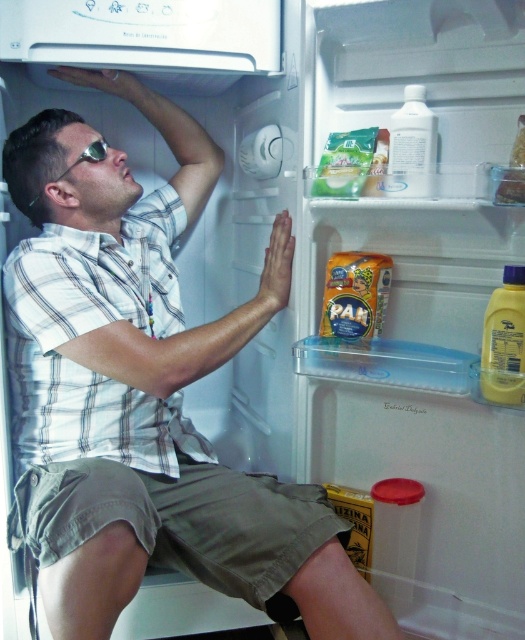
Question: Which point is closer to the camera?

Choices:
 (A) yellow plastic bottle at right
 (B) translucent plastic container at upper right
 (C) sunglasses at upper left

Answer: (B)

Question: Which of the following is the farthest from the observer?

Choices:
 (A) (520, 115)
 (B) (100, 148)

Answer: (B)

Question: Is yellow plastic bottle at right closer to the viewer compared to sunglasses at upper left?

Choices:
 (A) no
 (B) yes

Answer: (B)

Question: Does yellow matte pan at center have a lesser width compared to yellow plastic bottle at right?

Choices:
 (A) yes
 (B) no

Answer: (B)

Question: Can you confirm if yellow matte pan at center is positioned to the right of translucent plastic container at upper right?

Choices:
 (A) yes
 (B) no

Answer: (B)

Question: Which of the following is the farthest from the observer?

Choices:
 (A) (94, 141)
 (B) (518, 125)
 (C) (500, 355)
 (D) (342, 268)

Answer: (A)